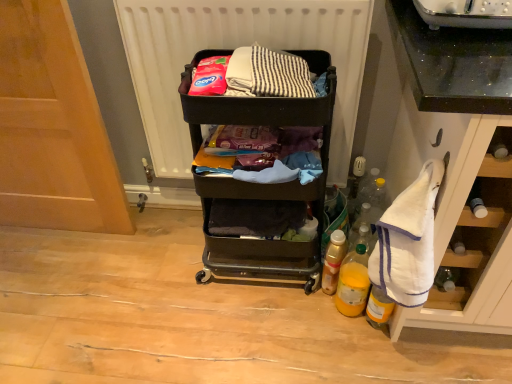
Find the location of a particular element. The image size is (512, 384). unoccupied area in front of black plastic cart at center is located at coordinates (264, 329).